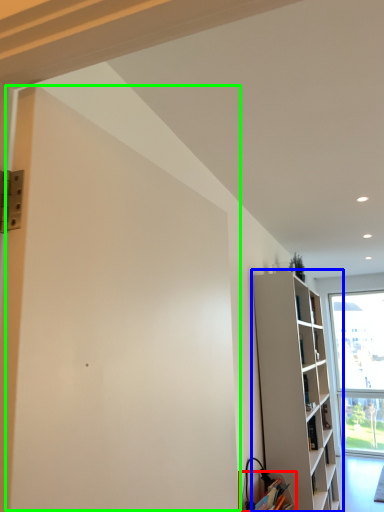
Question: Considering the real-world distances, which object is closest to cabinetry (highlighted by a red box)? shelf (highlighted by a blue box) or screen door (highlighted by a green box).

Choices:
 (A) shelf
 (B) screen door

Answer: (A)